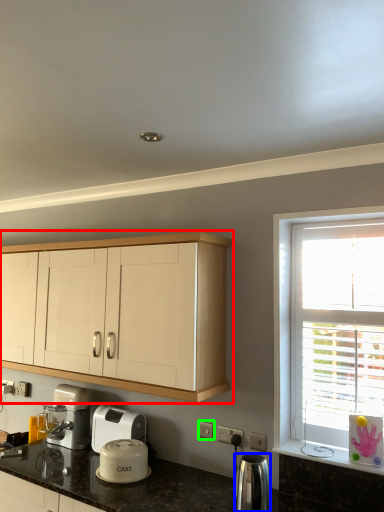
Question: Estimate the real-world distances between objects in this image. Which object is closer to cabinetry (highlighted by a red box), kitchen appliance (highlighted by a blue box) or electric outlet (highlighted by a green box)?

Choices:
 (A) kitchen appliance
 (B) electric outlet

Answer: (B)